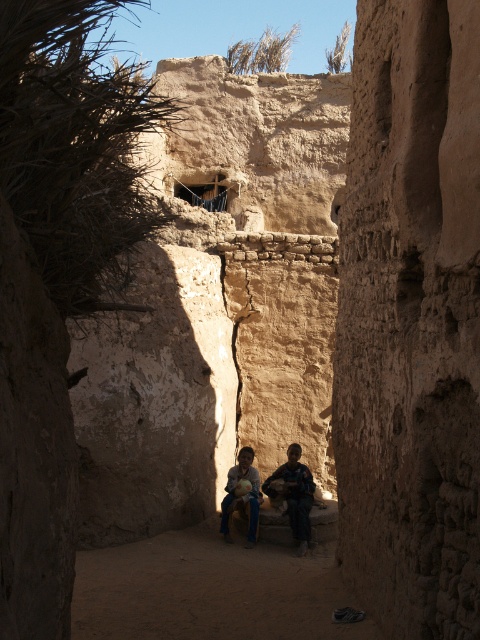
Describe the element at coordinates (210, 589) in the screenshot. I see `brown rough stone alley at center` at that location.

Is brown rough stone alley at center smaller than matte brown child at center?

Incorrect, brown rough stone alley at center is not smaller in size than matte brown child at center.

Is point (208, 556) positioned before point (232, 483)?

Yes, point (208, 556) is in front of point (232, 483).

Locate an element on the screen. This screenshot has height=640, width=480. brown rough stone alley at center is located at coordinates (210, 589).

Is brown textured fabric at center above matte brown child at center?

Yes, brown textured fabric at center is above matte brown child at center.

Consider the image. Which of these two, brown textured fabric at center or matte brown child at center, stands shorter?

brown textured fabric at center

Which is behind, point (287, 483) or point (242, 467)?

The point (242, 467) is more distant.

At what (x,y) coordinates should I click in order to perform the action: click on brown textured fabric at center. Please return your answer as a coordinate pair (x, y). Looking at the image, I should click on (295, 493).

I want to click on brown rough stone alley at center, so click(210, 589).

Is point (298, 602) closer to viewer compared to point (300, 547)?

That is True.

Is point (301, 595) positioned before point (267, 492)?

Yes, it is in front of point (267, 492).

Where is `brown rough stone alley at center`? brown rough stone alley at center is located at coordinates (210, 589).